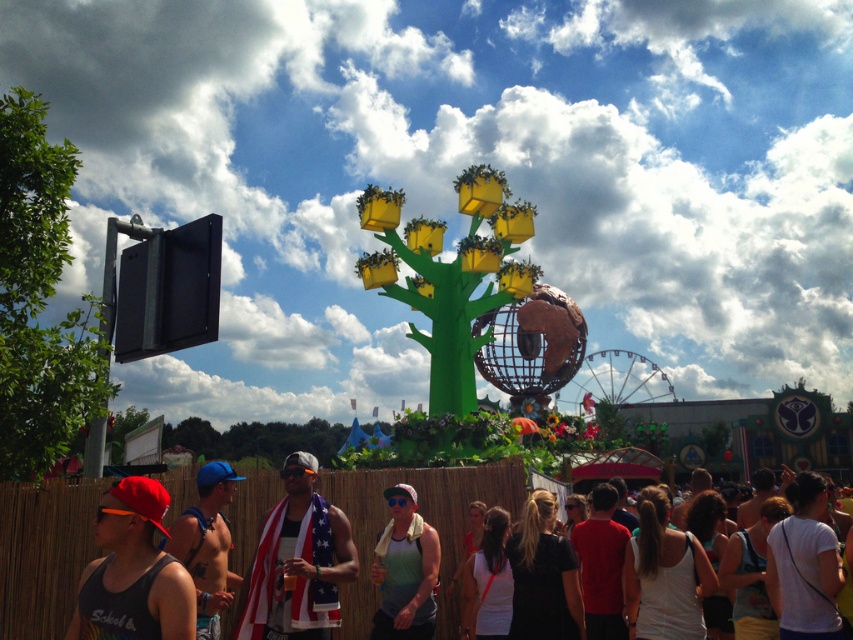
Looking at this image, is green matte tree at left behind american flag towel at center?

No, it is not.

Does green matte tree at left have a larger size compared to american flag towel at center?

Correct, green matte tree at left is larger in size than american flag towel at center.

Is point (44, 275) farther from viewer compared to point (270, 611)?

Yes, it is.

Locate an element on the screen. The width and height of the screenshot is (853, 640). green matte tree at left is located at coordinates (39, 298).

Does matte black tank top at lower left appear over shiny blue cap at center?

Incorrect, matte black tank top at lower left is not positioned above shiny blue cap at center.

Measure the distance from matte black tank top at lower left to shiny blue cap at center.

A distance of 8.04 meters exists between matte black tank top at lower left and shiny blue cap at center.

Locate an element on the screen. The width and height of the screenshot is (853, 640). matte black tank top at lower left is located at coordinates (132, 572).

Does american flag towel at center appear on the left side of shiny blue cap at center?

No, american flag towel at center is not to the left of shiny blue cap at center.

Does american flag towel at center have a greater height compared to shiny blue cap at center?

Correct, american flag towel at center is much taller as shiny blue cap at center.

Is point (297, 488) farther from camera compared to point (172, 554)?

Yes, point (297, 488) is behind point (172, 554).

This screenshot has height=640, width=853. What are the coordinates of `american flag towel at center` in the screenshot? It's located at click(297, 561).